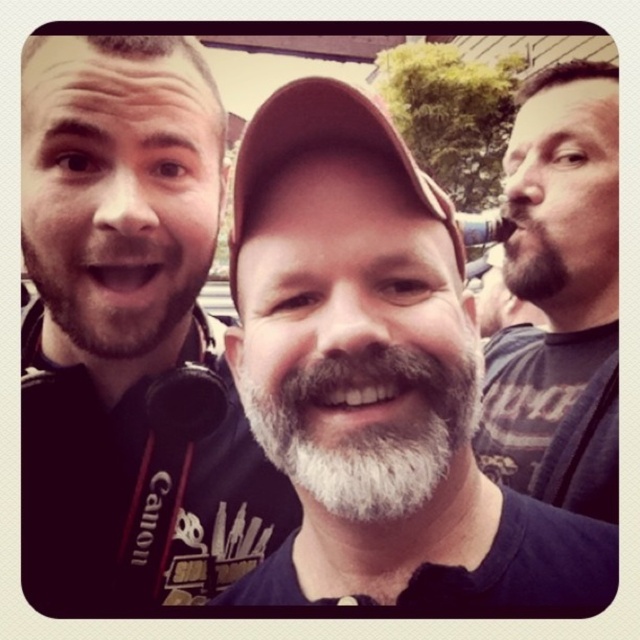
Is dark brown stubble at left taller than brown fabric cap at center?

Incorrect, dark brown stubble at left's height is not larger of brown fabric cap at center's.

Who is taller, dark brown stubble at left or brown fabric cap at center?

brown fabric cap at center

Locate an element on the screen. dark brown stubble at left is located at coordinates (116, 285).

From the picture: Can you confirm if dark blue t-shirt at right is wider than dark brown stubble at left?

No, dark blue t-shirt at right is not wider than dark brown stubble at left.

Which is behind, point (480, 449) or point (163, 282)?

The point (480, 449) is behind.

Describe the element at coordinates (560, 298) in the screenshot. The image size is (640, 640). I see `dark blue t-shirt at right` at that location.

Find the location of `dark blue t-shirt at right`. dark blue t-shirt at right is located at coordinates (560, 298).

Is point (42, 451) less distant than point (348, 141)?

That is False.

Between point (28, 417) and point (257, 195), which one is positioned behind?

The point (28, 417) is more distant.

Where is `matte black hoodie at left`? Image resolution: width=640 pixels, height=640 pixels. matte black hoodie at left is located at coordinates (125, 333).